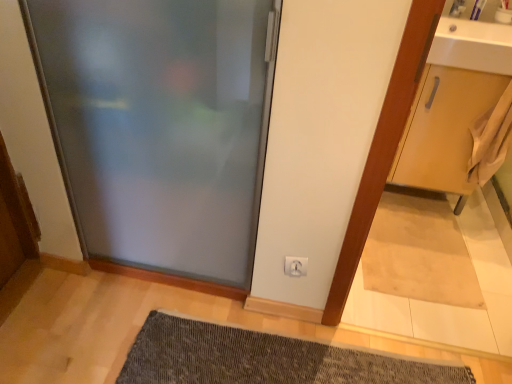
Locate an element on the screen. The height and width of the screenshot is (384, 512). vacant space situated above white glossy sink at upper right (from a real-world perspective) is located at coordinates (478, 28).